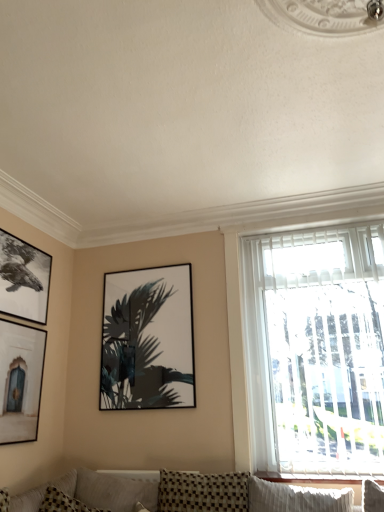
Question: From the image's perspective, would you say matte black picture frame at center, arranged as the 1th picture frame when viewed from the right, is positioned over black matte picture frame at upper left, the third picture frame positioned from the right?

Choices:
 (A) no
 (B) yes

Answer: (A)

Question: Is there a large distance between matte black picture frame at center, arranged as the 1th picture frame when viewed from the right, and black matte picture frame at upper left, the 1th picture frame when ordered from left to right?

Choices:
 (A) no
 (B) yes

Answer: (A)

Question: Does matte black picture frame at center, arranged as the 1th picture frame when viewed from the right, have a lesser height compared to black matte picture frame at upper left, the 1th picture frame when ordered from left to right?

Choices:
 (A) no
 (B) yes

Answer: (A)

Question: Is matte black picture frame at center, which is the third picture frame in left-to-right order, outside of black matte picture frame at upper left, the 1th picture frame when ordered from left to right?

Choices:
 (A) yes
 (B) no

Answer: (A)

Question: From the image's perspective, is matte black picture frame at center, which is the third picture frame in left-to-right order, below black matte picture frame at upper left, the third picture frame positioned from the right?

Choices:
 (A) no
 (B) yes

Answer: (B)

Question: Considering the positions of white textured blinds at right and black matte picture frame at upper left, the 1th picture frame when ordered from left to right, in the image, is white textured blinds at right wider or thinner than black matte picture frame at upper left, the 1th picture frame when ordered from left to right,?

Choices:
 (A) thin
 (B) wide

Answer: (B)

Question: Is white textured blinds at right in front of or behind black matte picture frame at upper left, the third picture frame positioned from the right, in the image?

Choices:
 (A) front
 (B) behind

Answer: (A)

Question: Considering the positions of white textured blinds at right and black matte picture frame at upper left, the third picture frame positioned from the right, in the image, is white textured blinds at right taller or shorter than black matte picture frame at upper left, the third picture frame positioned from the right,?

Choices:
 (A) short
 (B) tall

Answer: (B)

Question: Considering the positions of white textured blinds at right and black matte picture frame at upper left, the third picture frame positioned from the right, in the image, is white textured blinds at right bigger or smaller than black matte picture frame at upper left, the third picture frame positioned from the right,?

Choices:
 (A) big
 (B) small

Answer: (A)

Question: Considering the positions of point (14, 311) and point (332, 315), is point (14, 311) closer or farther from the camera than point (332, 315)?

Choices:
 (A) closer
 (B) farther

Answer: (A)

Question: Is black matte picture frame at upper left, the third picture frame positioned from the right, wider or thinner than white textured blinds at right?

Choices:
 (A) wide
 (B) thin

Answer: (B)

Question: From their relative heights in the image, would you say black matte picture frame at upper left, the 1th picture frame when ordered from left to right, is taller or shorter than white textured blinds at right?

Choices:
 (A) short
 (B) tall

Answer: (A)

Question: In the image, is black matte picture frame at upper left, the third picture frame positioned from the right, on the left side or the right side of white textured blinds at right?

Choices:
 (A) right
 (B) left

Answer: (B)

Question: Is white textured blinds at right taller or shorter than matte black picture frame at center, arranged as the 1th picture frame when viewed from the right?

Choices:
 (A) short
 (B) tall

Answer: (B)

Question: From a real-world perspective, is white textured blinds at right physically located above or below matte black picture frame at center, which is the third picture frame in left-to-right order?

Choices:
 (A) above
 (B) below

Answer: (B)